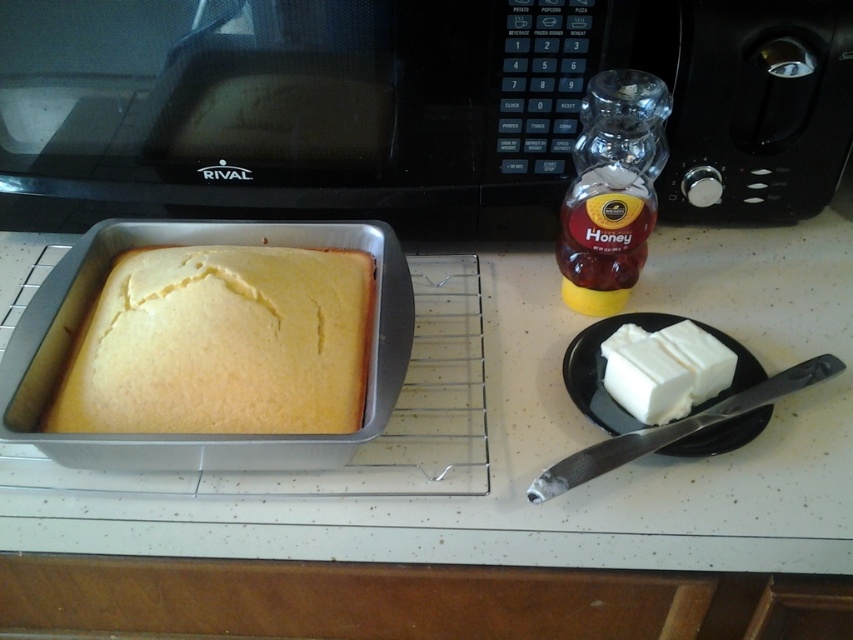
Who is more forward, (x=169, y=115) or (x=653, y=108)?

Point (x=653, y=108)

Is black plastic microwave at upper center behind translucent glass honey jar at right?

Yes, it is.

Is point (561, 54) more distant than point (599, 120)?

Yes, point (561, 54) is behind point (599, 120).

This screenshot has width=853, height=640. Identify the location of black plastic microwave at upper center. (405, 108).

Is black plastic microwave at upper center below white creamy butter at right?

No.

Find the location of a particular element. This screenshot has width=853, height=640. black plastic microwave at upper center is located at coordinates (405, 108).

Can you confirm if yellow matte cake at center is smaller than white creamy butter at right?

Incorrect, yellow matte cake at center is not smaller in size than white creamy butter at right.

Can you confirm if yellow matte cake at center is positioned to the left of white creamy butter at right?

Yes, yellow matte cake at center is to the left of white creamy butter at right.

Identify the location of yellow matte cake at center. (222, 342).

Locate an element on the screen. yellow matte cake at center is located at coordinates (222, 342).